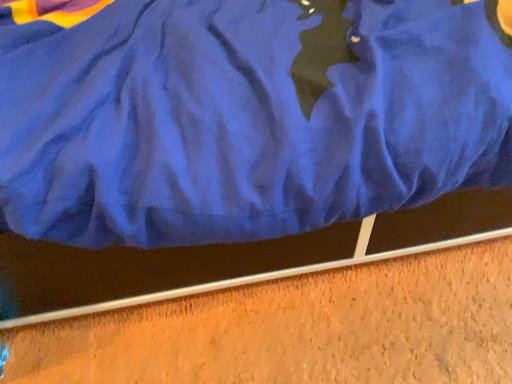
Identify the location of matte blue fabric at upper center. The image size is (512, 384). (243, 115).

The height and width of the screenshot is (384, 512). What do you see at coordinates (243, 115) in the screenshot?
I see `matte blue fabric at upper center` at bounding box center [243, 115].

Where is `matte blue fabric at upper center`? matte blue fabric at upper center is located at coordinates (243, 115).